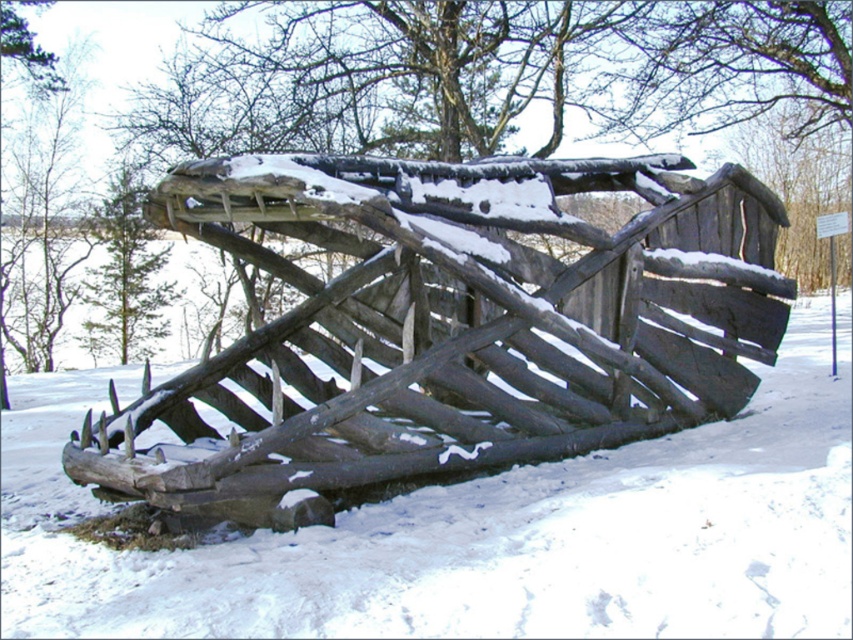
Is point (405, 340) behind point (346, 525)?

Yes, point (405, 340) is behind point (346, 525).

Measure the distance between point (306,509) and camera.

5.74 meters

I want to click on rustic wooden fence at center, so click(x=450, y=326).

I want to click on rustic wooden fence at center, so click(450, 326).